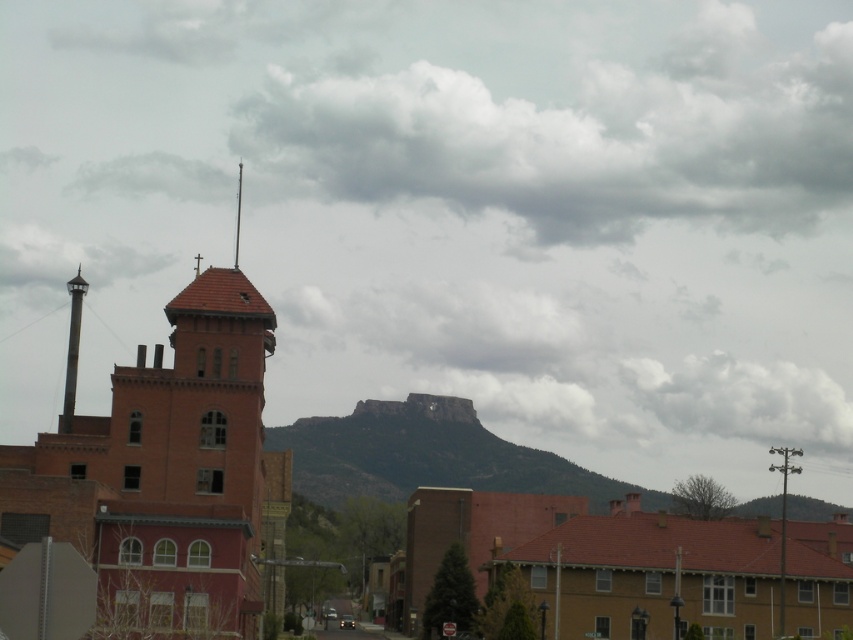
Question: Which point is closer to the camera?

Choices:
 (A) (473, 410)
 (B) (817, 401)
 (C) (51, 243)
 (D) (672, 64)

Answer: (A)

Question: Which point appears farthest from the camera in this image?

Choices:
 (A) (10, 264)
 (B) (799, 406)
 (C) (437, 432)

Answer: (B)

Question: Is cloudy sky at upper center below cloudy gray cloud at upper center?

Choices:
 (A) yes
 (B) no

Answer: (B)

Question: Does rocky brown mountain at center appear under cloudy gray cloud at upper center?

Choices:
 (A) no
 (B) yes

Answer: (B)

Question: Which point is farther to the camera?

Choices:
 (A) white fluffy cloud at upper center
 (B) rocky brown mountain at center

Answer: (B)

Question: Is cloudy sky at upper center above rocky brown mountain at center?

Choices:
 (A) yes
 (B) no

Answer: (A)